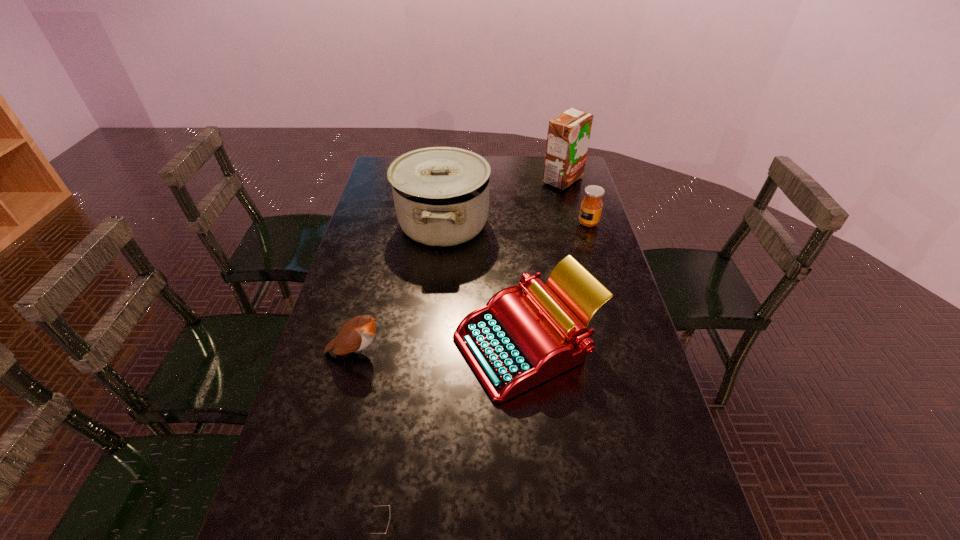
Find the location of a particular element. This screenshot has width=960, height=540. vacant space situated on the typing side of the typewriter is located at coordinates (423, 345).

The width and height of the screenshot is (960, 540). What are the coordinates of `vacant space situated on the typing side of the typewriter` in the screenshot? It's located at (324, 345).

This screenshot has height=540, width=960. I want to click on vacant space located on the front-facing side of the honey, so click(545, 223).

The height and width of the screenshot is (540, 960). I want to click on free location located on the front-facing side of the honey, so click(479, 223).

The height and width of the screenshot is (540, 960). I want to click on vacant space located 0.140m on the front-facing side of the honey, so click(x=540, y=223).

Identify the location of vacant area situated 0.150m at the face of the bird. (441, 352).

Identify the location of object present at the far edge. This screenshot has height=540, width=960. pyautogui.click(x=568, y=136).

Where is `saucepan at the left edge`? The width and height of the screenshot is (960, 540). saucepan at the left edge is located at coordinates (441, 194).

Find the location of `bird present at the left edge`. bird present at the left edge is located at coordinates (356, 334).

The width and height of the screenshot is (960, 540). Find the location of `carton present at the right edge`. carton present at the right edge is located at coordinates (568, 136).